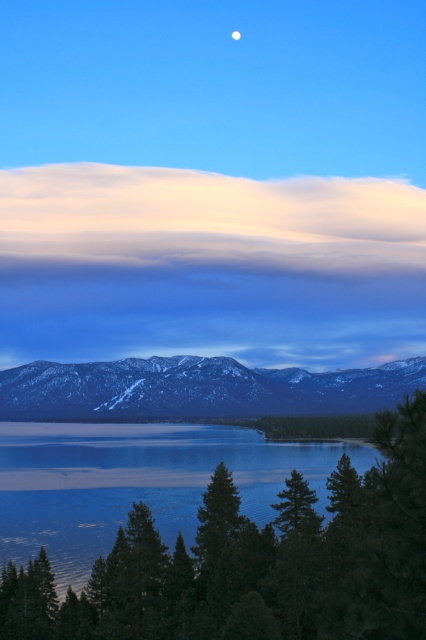
Question: Which object appears farthest from the camera in this image?

Choices:
 (A) snow-covered mountain range at center
 (B) blue glassy water at lower center

Answer: (A)

Question: Can you confirm if snow-covered mountain range at center is smaller than green matte tree at center?

Choices:
 (A) yes
 (B) no

Answer: (B)

Question: Which point is closer to the camera taking this photo?

Choices:
 (A) (322, 472)
 (B) (5, 372)
 (C) (288, 525)

Answer: (C)

Question: Which object appears closest to the camera in this image?

Choices:
 (A) snow-covered mountain range at center
 (B) blue glassy water at lower center
 (C) green matte tree at center
 (D) white matte moon at upper center

Answer: (C)

Question: Does snow-covered mountain range at center appear on the right side of green matte tree at center?

Choices:
 (A) no
 (B) yes

Answer: (A)

Question: Does snow-covered mountain range at center appear on the left side of white matte moon at upper center?

Choices:
 (A) yes
 (B) no

Answer: (A)